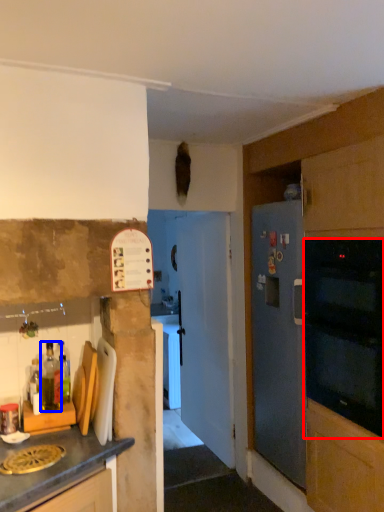
Question: Which point is closer to the camera, oven (highlighted by a red box) or bottle (highlighted by a blue box)?

Choices:
 (A) oven
 (B) bottle

Answer: (A)